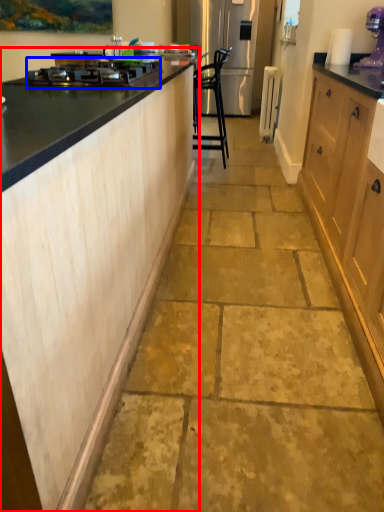
Question: Which of the following is the farthest to the observer, cabinetry (highlighted by a red box) or home appliance (highlighted by a blue box)?

Choices:
 (A) cabinetry
 (B) home appliance

Answer: (B)